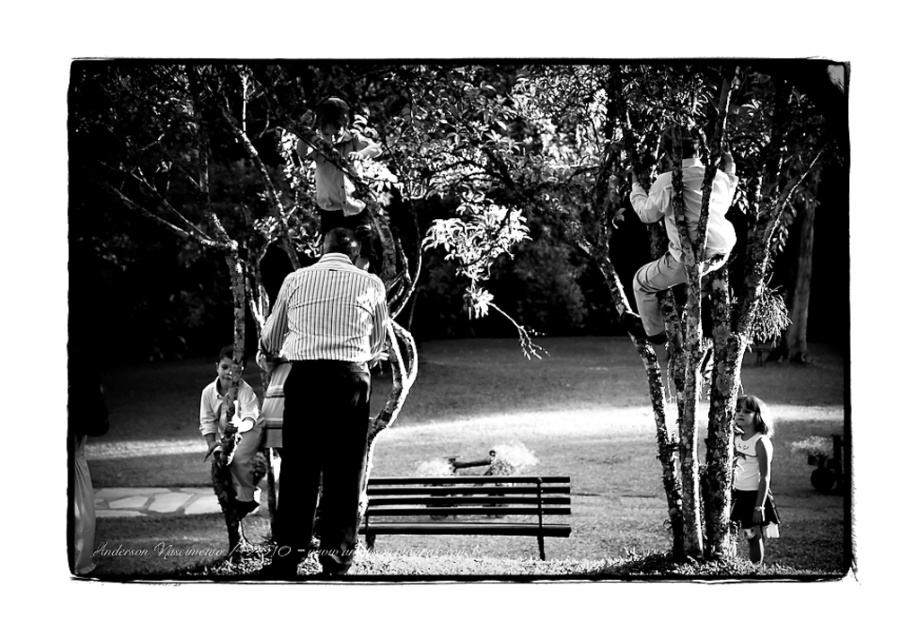
Who is more forward, (319, 115) or (736, 404)?

Point (319, 115) is in front.

Who is more distant from viewer, (327, 116) or (767, 532)?

The point (327, 116) is behind.

Does point (328, 128) come in front of point (734, 413)?

No, (328, 128) is behind (734, 413).

Identify the location of smooth white shirt at upper center. (335, 195).

Which is behind, point (390, 493) or point (751, 448)?

Point (390, 493)

Which of these two, wooden bench at center or white matte dress at lower right, stands shorter?

white matte dress at lower right

Identify the location of wooden bench at center. The image size is (919, 640). (467, 506).

Locate an element on the screen. The height and width of the screenshot is (640, 919). wooden bench at center is located at coordinates (467, 506).

Is smooth bark tree at upper center closer to camera compared to wooden bench at center?

Yes, smooth bark tree at upper center is closer to the viewer.

Looking at this image, which of these two, smooth bark tree at upper center or wooden bench at center, stands shorter?

With less height is wooden bench at center.

At what (x,y) coordinates should I click in order to perform the action: click on smooth bark tree at upper center. Please return your answer as a coordinate pair (x, y). The image size is (919, 640). Looking at the image, I should click on (450, 307).